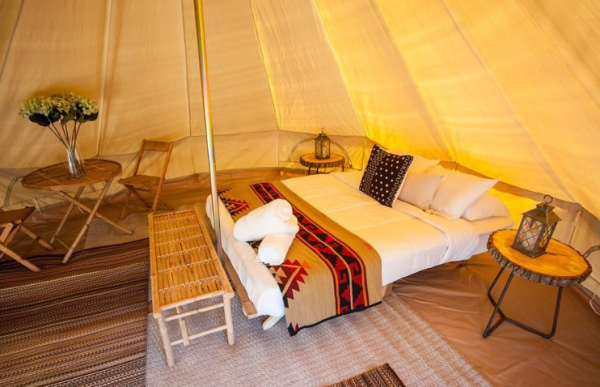
The image size is (600, 387). What are the coordinates of `lanterns` in the screenshot? It's located at (534, 232), (323, 150).